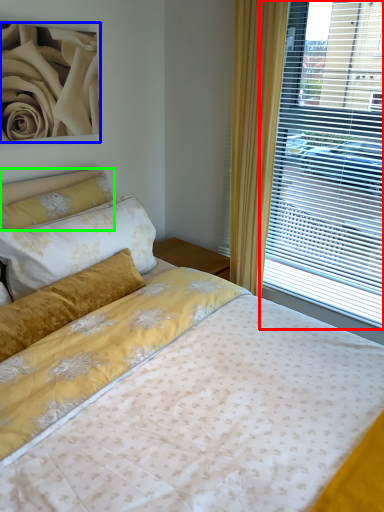
Question: Based on their relative distances, which object is nearer to window (highlighted by a red box)? Choose from rose (highlighted by a blue box) and pillow (highlighted by a green box).

Choices:
 (A) rose
 (B) pillow

Answer: (B)